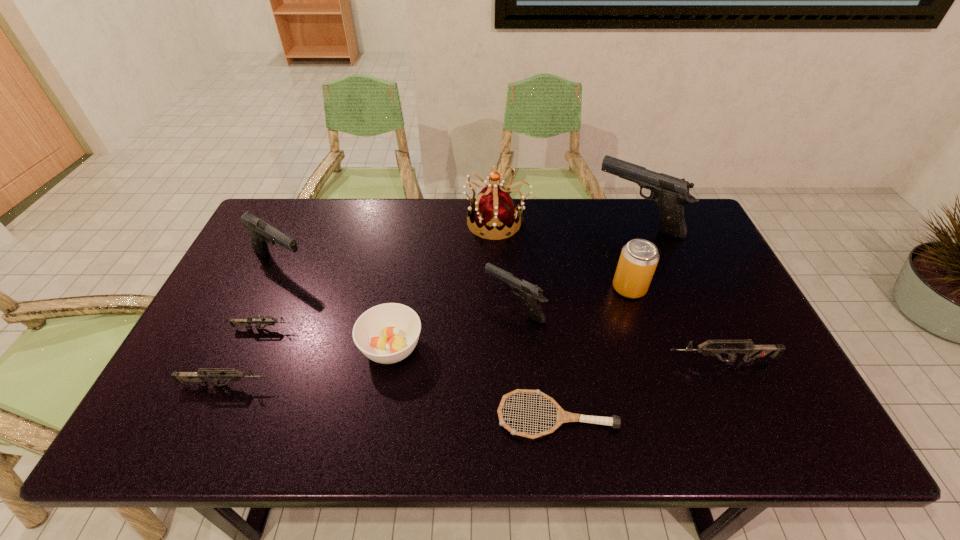
Select which grey gun appears as the second closest to the soup bowl. Please provide its 2D coordinates. Your answer should be formatted as a tuple, i.e. [(x, y)], where the tuple contains the x and y coordinates of a point satisfying the conditions above.

[(234, 375)]

This screenshot has height=540, width=960. Find the location of `vacant space that satisfies the following two spatial constraints: 1. aimed along the barrel of the shortest gun; 2. on the left side of the seventh object from right to left`. vacant space that satisfies the following two spatial constraints: 1. aimed along the barrel of the shortest gun; 2. on the left side of the seventh object from right to left is located at coordinates (256, 348).